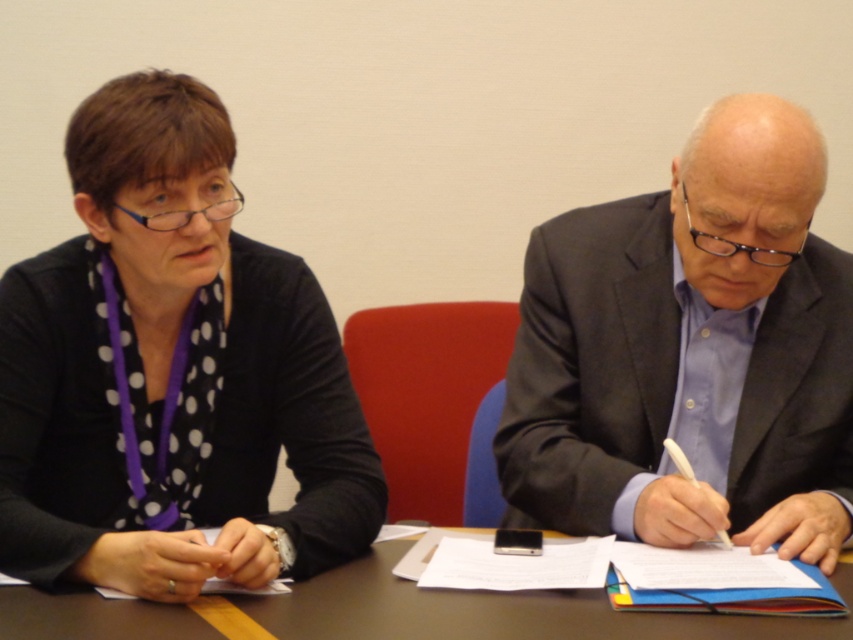
Can you confirm if matte black suit at right is positioned below brown wooden table at center?

No.

Does matte black suit at right lie in front of brown wooden table at center?

No.

Where is `matte black suit at right`? matte black suit at right is located at coordinates (695, 355).

Which is behind, point (253, 554) or point (51, 632)?

Point (253, 554)

Between point (155, 496) and point (844, 628), which one is positioned in front?

Point (844, 628) is in front.

At what (x,y) coordinates should I click in order to perform the action: click on polka dot fabric at left. Please return your answer as a coordinate pair (x, y). Looking at the image, I should click on (171, 372).

Identify the location of polka dot fabric at left. This screenshot has width=853, height=640. (171, 372).

Who is taller, polka dot fabric at left or matte black suit at right?

polka dot fabric at left is taller.

Can you confirm if polka dot fabric at left is bigger than matte black suit at right?

Correct, polka dot fabric at left is larger in size than matte black suit at right.

Image resolution: width=853 pixels, height=640 pixels. What are the coordinates of `polka dot fabric at left` in the screenshot? It's located at (171, 372).